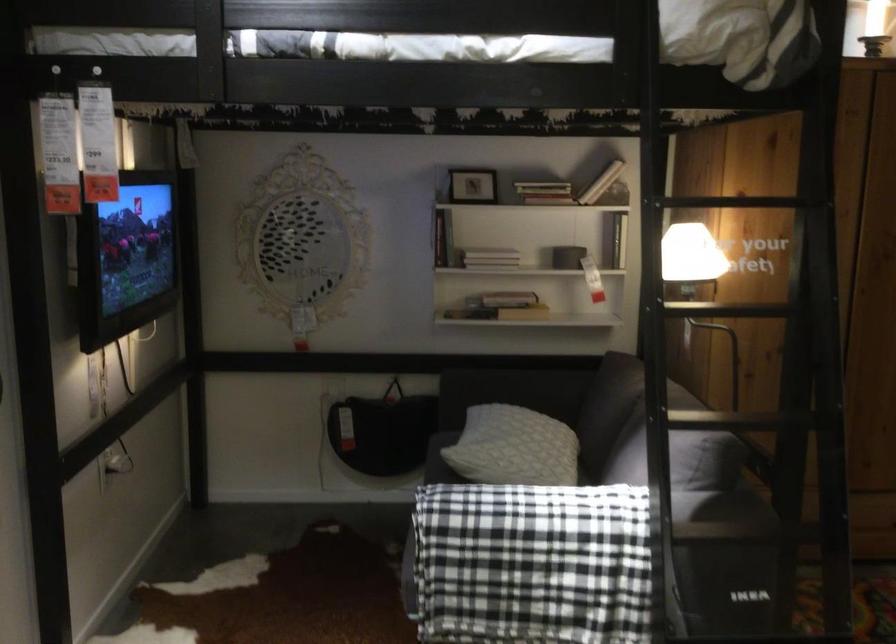
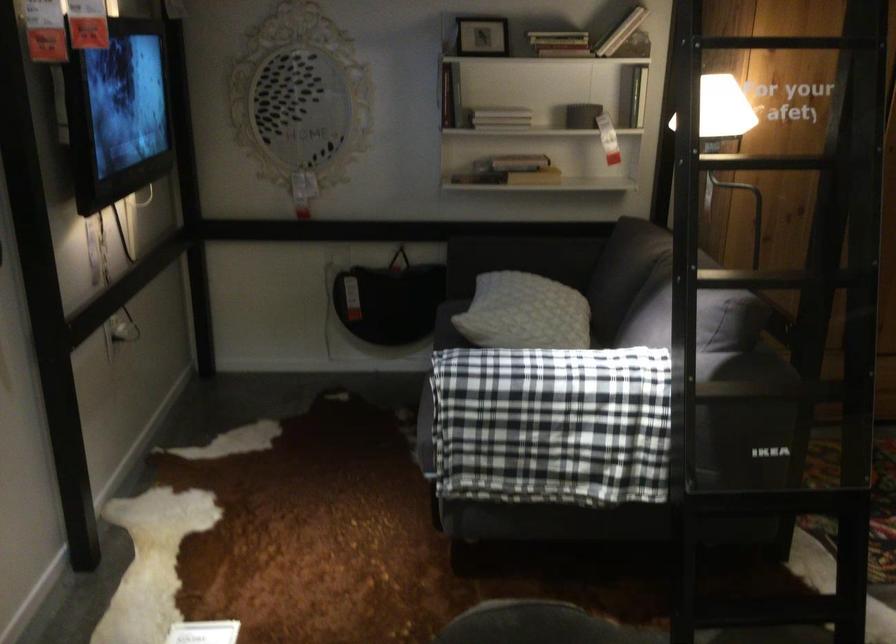
Where in the second image is the point corresponding to point (722, 513) from the first image?

(745, 366)